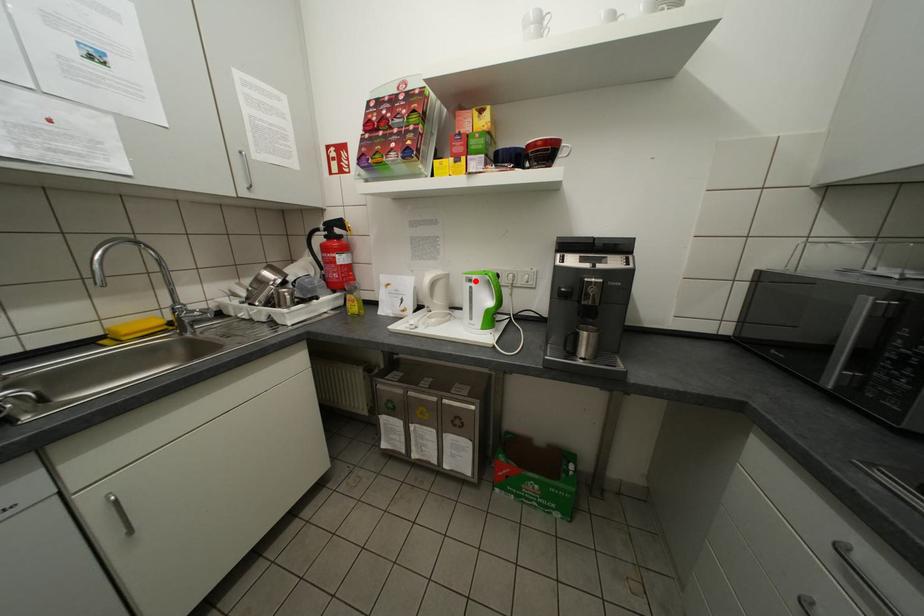
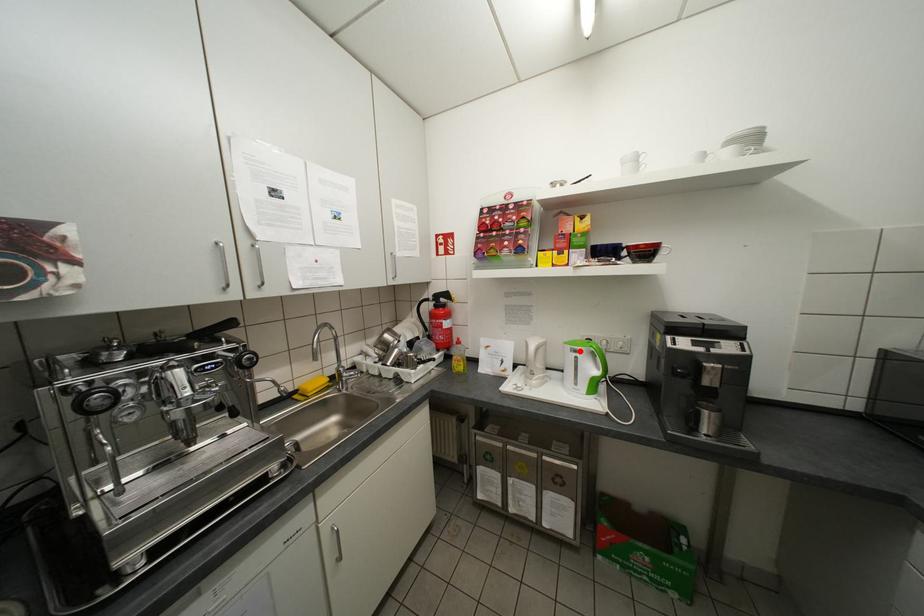
I am providing you with two images of the same scene from different viewpoints. A red point is marked on the first image and another point is marked on the second image. Do the highlighted points in image1 and image2 indicate the same real-world spot?

Yes